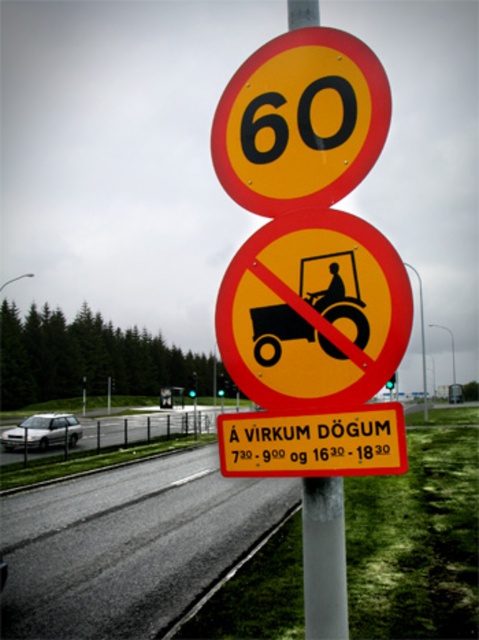
Who is more forward, (375, 468) or (324, 540)?

Point (375, 468) is more forward.

Who is positioned more to the right, yellowmaterial/texturewarning sign at upper center or metallic pole at center?

Positioned to the right is metallic pole at center.

The height and width of the screenshot is (640, 479). I want to click on yellowmaterial/texturewarning sign at upper center, so click(x=314, y=442).

From the picture: Does yellow matte sign at upper center appear over yellowmaterial/texturewarning sign at upper center?

Yes, yellow matte sign at upper center is above yellowmaterial/texturewarning sign at upper center.

Who is more distant from viewer, (226,157) or (358,449)?

Point (226,157)

Locate an element on the screen. yellow matte sign at upper center is located at coordinates (300, 122).

Which is behind, point (320, 179) or point (308, 589)?

Positioned behind is point (320, 179).

Can you confirm if yellow matte sign at upper center is wider than metallic pole at center?

Correct, the width of yellow matte sign at upper center exceeds that of metallic pole at center.

Does point (274, 204) come closer to viewer compared to point (318, 592)?

No, it is not.

Identify the location of yellow matte sign at upper center. (300, 122).